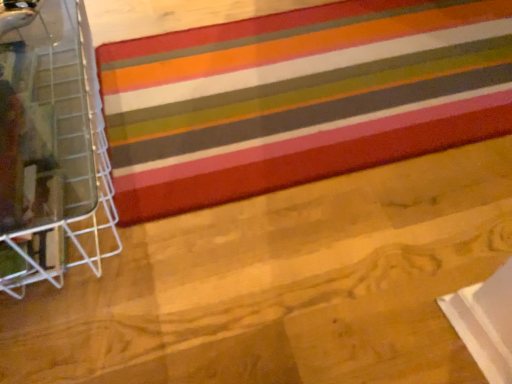
Image resolution: width=512 pixels, height=384 pixels. In order to click on vacant space underneath multicolored striped rug at center (from a real-world perspective) in this screenshot , I will do `click(324, 75)`.